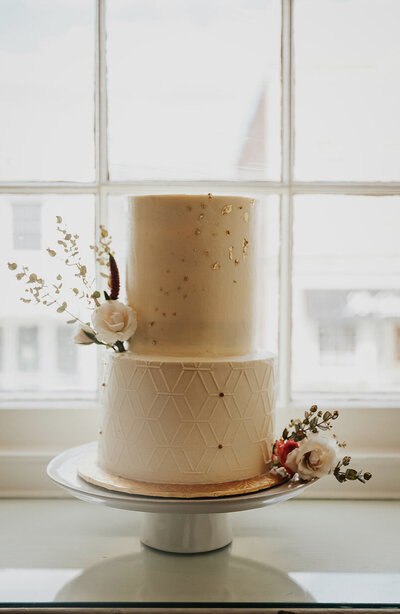
Where is `window panes`? The image size is (400, 614). window panes is located at coordinates (12, 350), (49, 82), (214, 98), (358, 109), (325, 271), (265, 245).